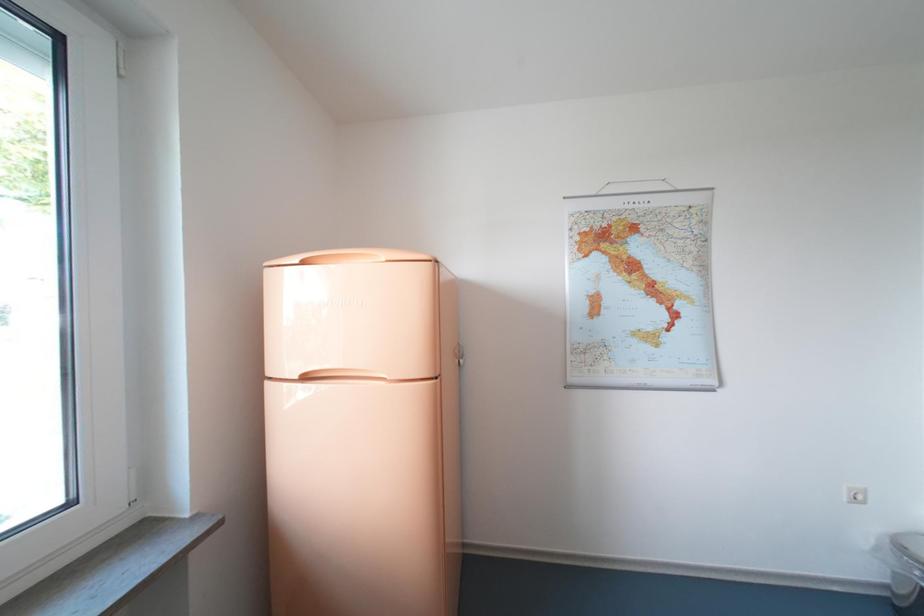
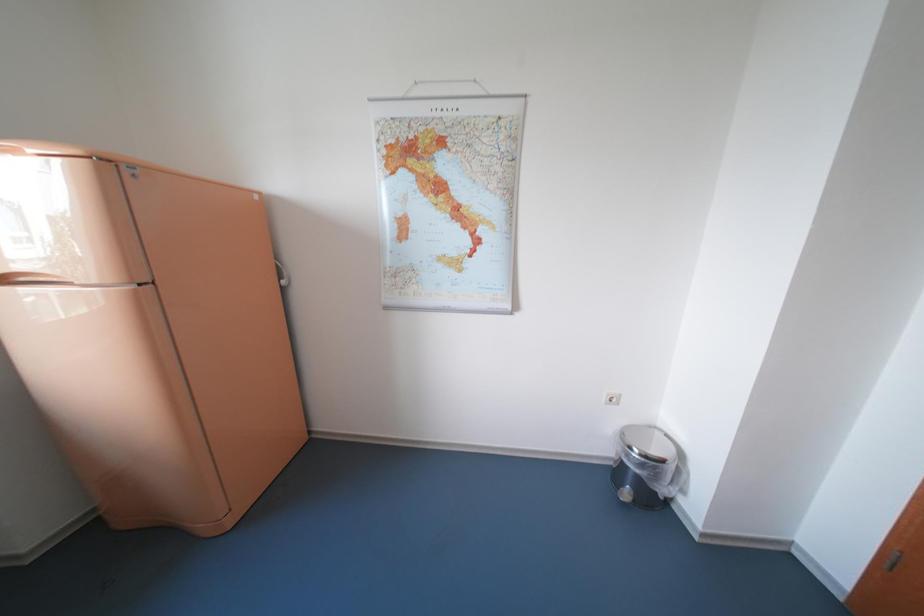
Question: The images are taken continuously from a first-person perspective. In which direction are you moving?

Choices:
 (A) Left
 (B) Right
 (C) Forward
 (D) Backward

Answer: (B)